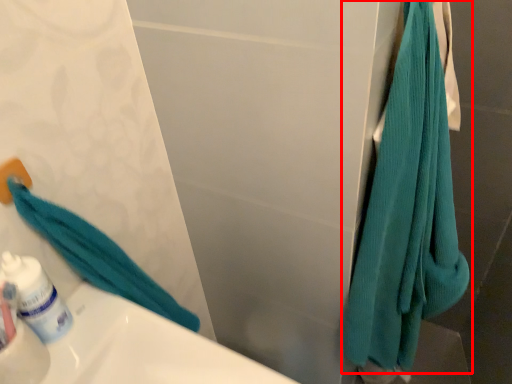
Question: Observing the image, what is the correct spatial positioning of towel (annotated by the red box) in reference to mouthwash?

Choices:
 (A) left
 (B) right

Answer: (B)